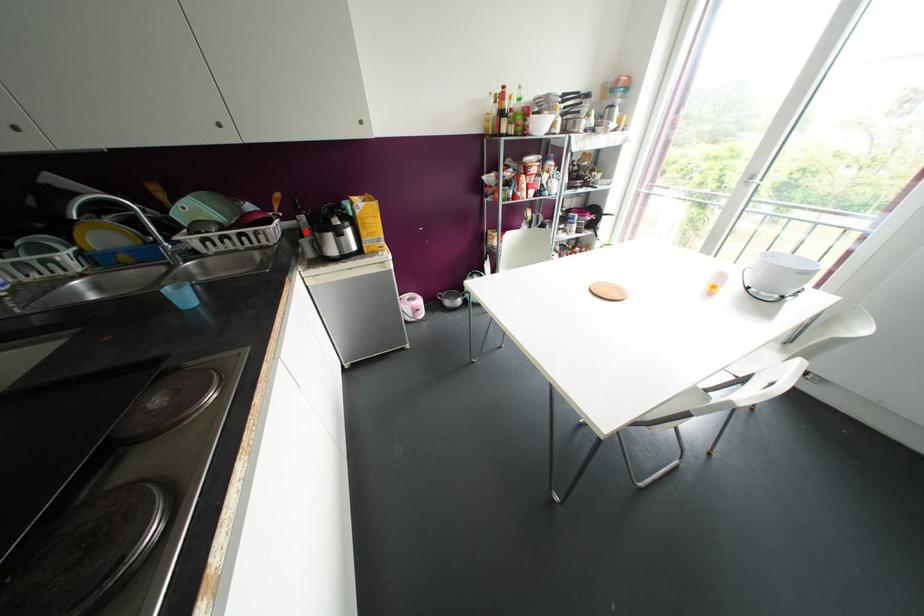
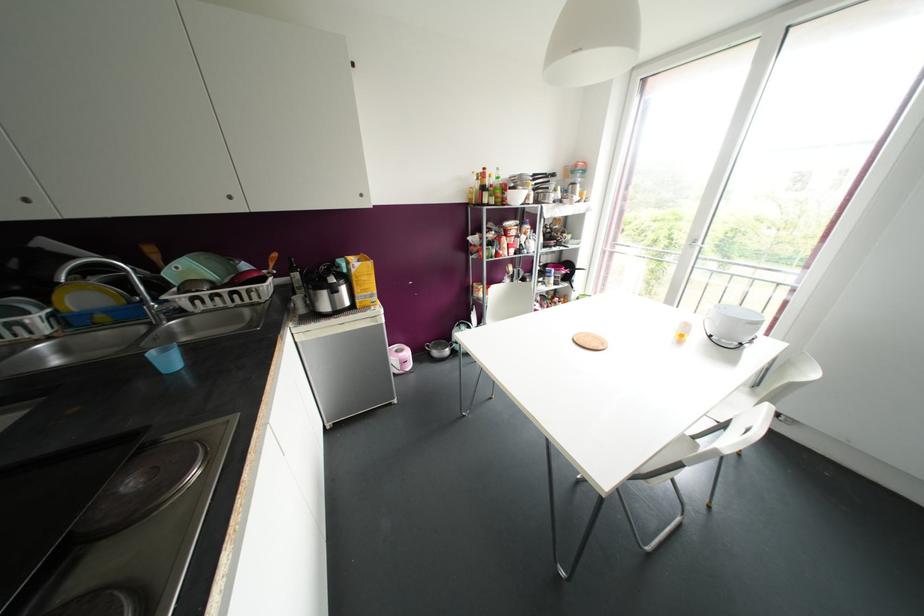
Locate, in the second image, the point that corresponds to the highlighted location in the first image.

(298, 286)